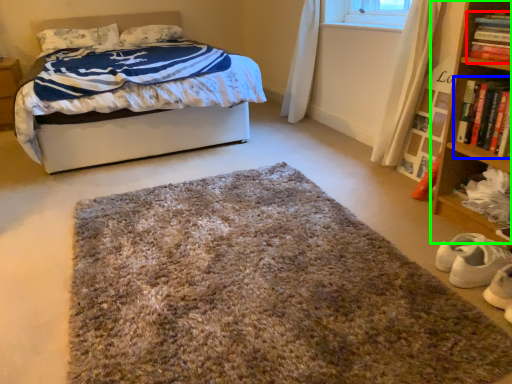
Question: Which object is positioned farthest from book (highlighted by a red box)? Select from book (highlighted by a blue box) and bookcase (highlighted by a green box).

Choices:
 (A) book
 (B) bookcase

Answer: (B)